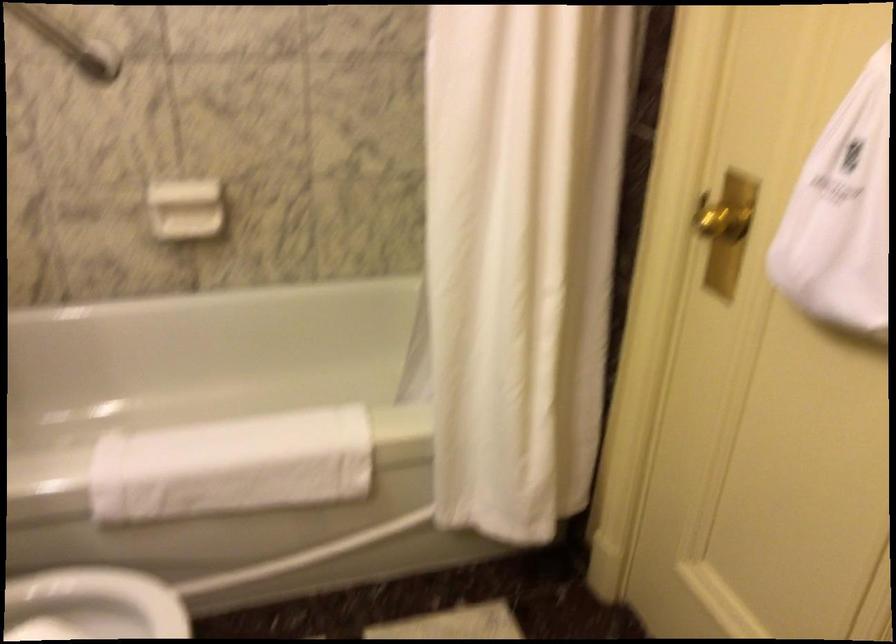
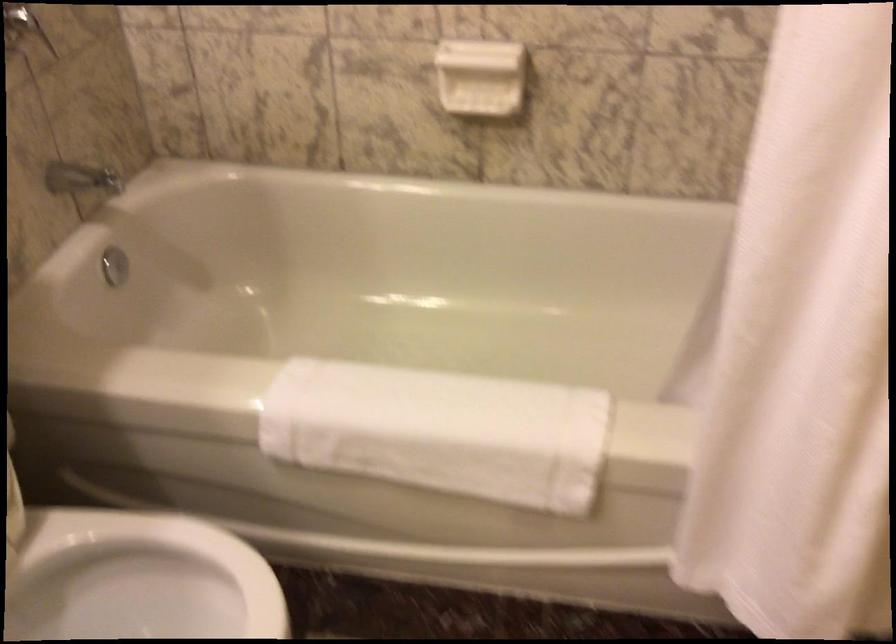
Question: The camera is either moving clockwise (left) or counter-clockwise (right) around the object. The first image is from the beginning of the video and the second image is from the end. Is the camera moving left or right when shooting the video?

Choices:
 (A) Left
 (B) Right

Answer: (B)